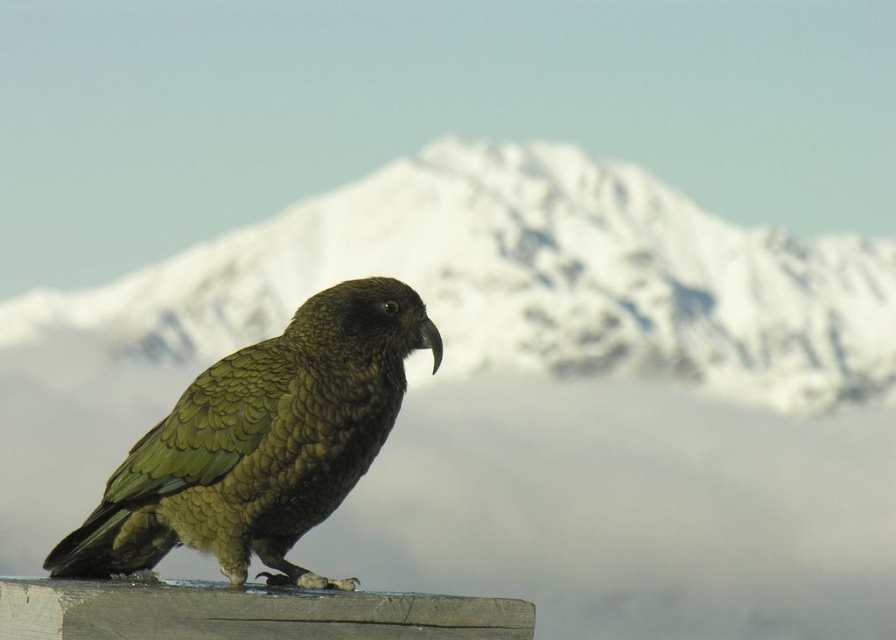
Which of these two, snowy mountain at upper center or green scaly parrot at center, stands shorter?

green scaly parrot at center

Is snowy mountain at upper center further to camera compared to green scaly parrot at center?

Yes.

The height and width of the screenshot is (640, 896). Identify the location of snowy mountain at upper center. (523, 282).